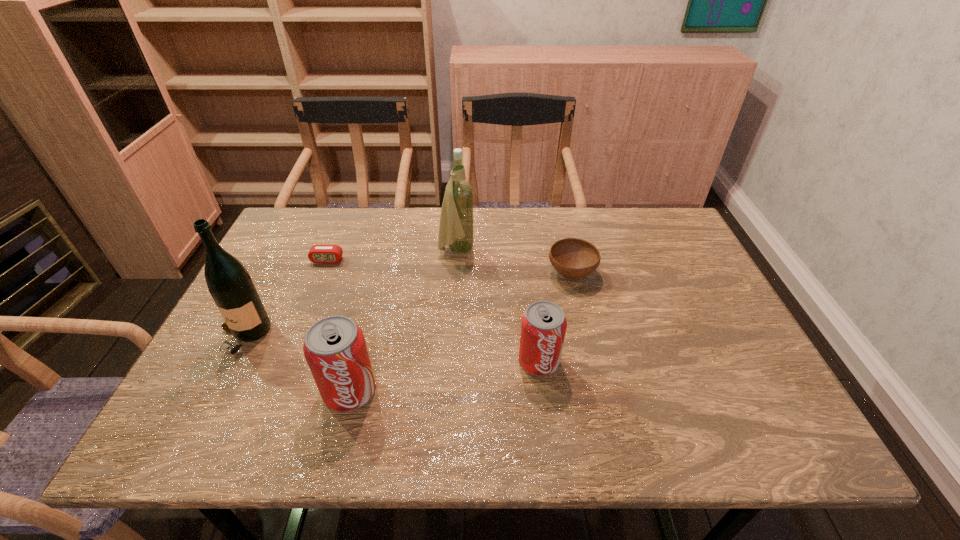
Locate an element on the screen. This screenshot has width=960, height=540. the taller soda can is located at coordinates [x=334, y=347].

Locate an element on the screen. The height and width of the screenshot is (540, 960). the left soda can is located at coordinates (334, 347).

Locate an element on the screen. the right soda can is located at coordinates (543, 326).

The height and width of the screenshot is (540, 960). Identify the location of the fifth object from left to right. (543, 326).

Locate an element on the screen. The image size is (960, 540). the farther wine bottle is located at coordinates (456, 229).

Image resolution: width=960 pixels, height=540 pixels. Find the location of `the right wine bottle`. the right wine bottle is located at coordinates (456, 229).

Identify the location of the second object from left to right. This screenshot has height=540, width=960. tap(318, 253).

This screenshot has height=540, width=960. I want to click on the shortest object, so click(318, 253).

Identify the location of the left wine bottle. (229, 283).

Identify the location of the leftmost object. (229, 283).